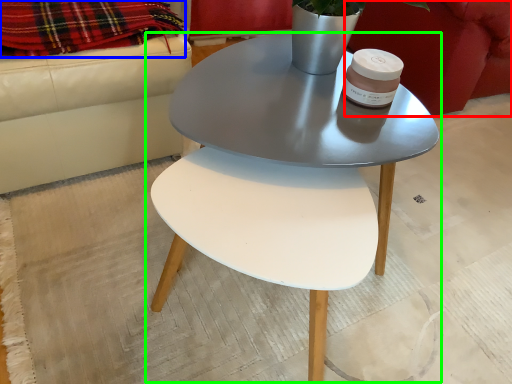
Question: Estimate the real-world distances between objects in this image. Which object is farther from armchair (highlighted by a red box), blanket (highlighted by a blue box) or coffee table (highlighted by a green box)?

Choices:
 (A) blanket
 (B) coffee table

Answer: (A)